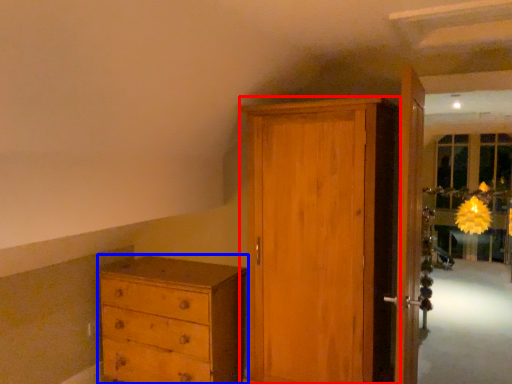
Question: Which object appears farthest to the camera in this image, door (highlighted by a red box) or chest of drawers (highlighted by a blue box)?

Choices:
 (A) door
 (B) chest of drawers

Answer: (B)